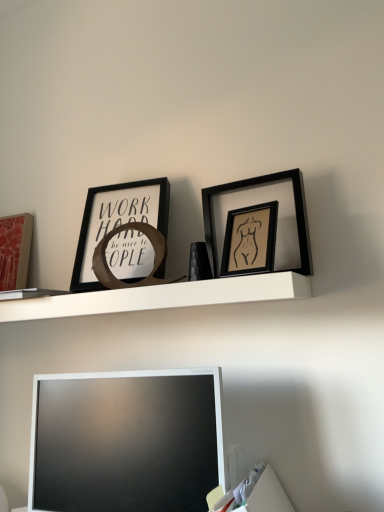
Question: Relative to white matte shelf at upper center, is matte pink picture frame at left, the 1th picture frame viewed from the back, in front or behind?

Choices:
 (A) front
 (B) behind

Answer: (B)

Question: From a real-world perspective, is matte pink picture frame at left, the 1th picture frame viewed from the back, positioned above or below white matte shelf at upper center?

Choices:
 (A) below
 (B) above

Answer: (B)

Question: Which of these objects is positioned closest to the matte black picture frame at upper left, which is the 3th picture frame in front-to-back order?

Choices:
 (A) white glossy television at lower center
 (B) matte pink picture frame at left, which is the 4th picture frame in front-to-back order
 (C) black matte picture frame at upper right, placed as the 4th picture frame when sorted from left to right
 (D) white matte shelf at upper center
 (E) matte black frame at upper center, which is the 2th picture frame from right to left

Answer: (D)

Question: Estimate the real-world distances between objects in this image. Which object is closer to the matte black frame at upper center, which is the 2th picture frame from right to left?

Choices:
 (A) white matte shelf at upper center
 (B) matte black picture frame at upper left, placed as the 3th picture frame when sorted from right to left
 (C) matte pink picture frame at left, which ranks as the fourth picture frame in right-to-left order
 (D) black matte picture frame at upper right, placed as the 4th picture frame when sorted from left to right
 (E) white glossy television at lower center

Answer: (D)